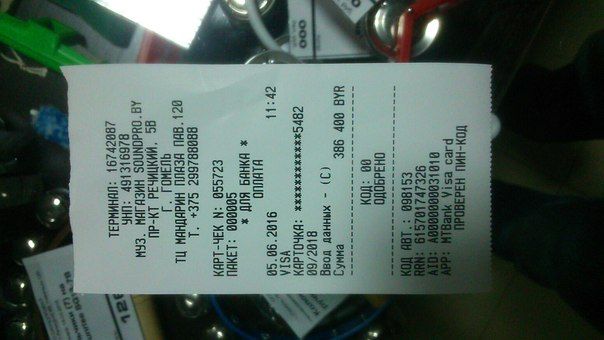
Identify the location of blue cord or wire. The width and height of the screenshot is (604, 340). tap(222, 312), tap(362, 327).